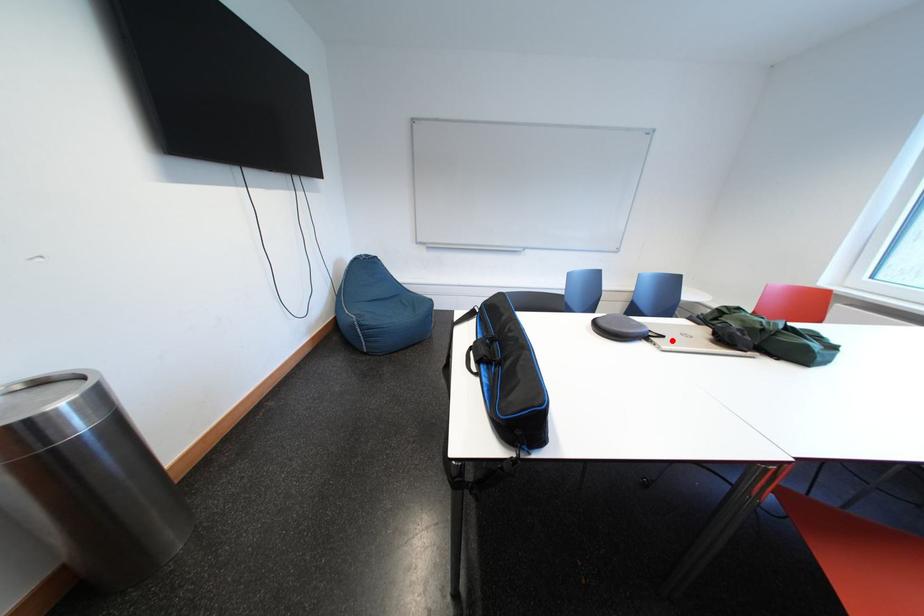
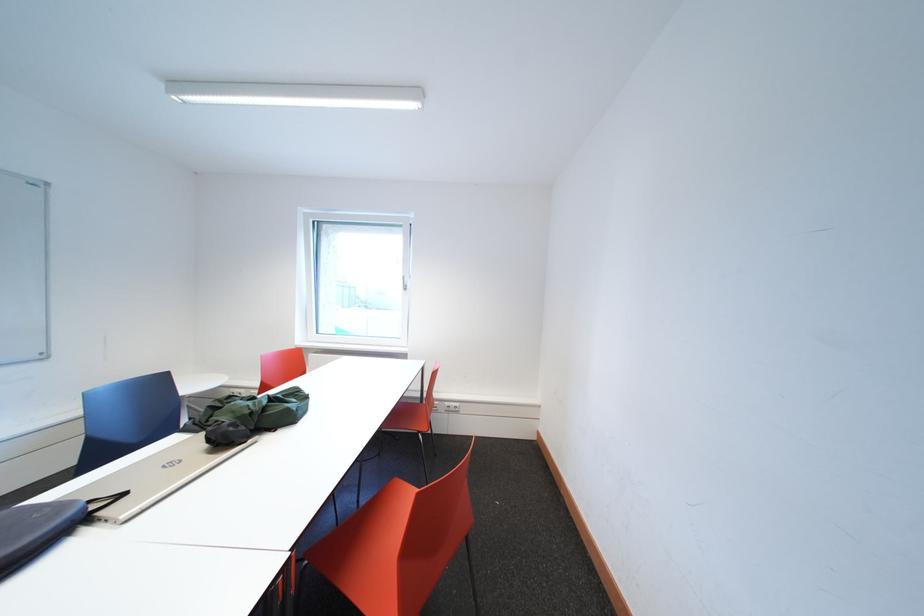
Locate, in the second image, the point that corresponds to the highlighted location in the first image.

(134, 499)